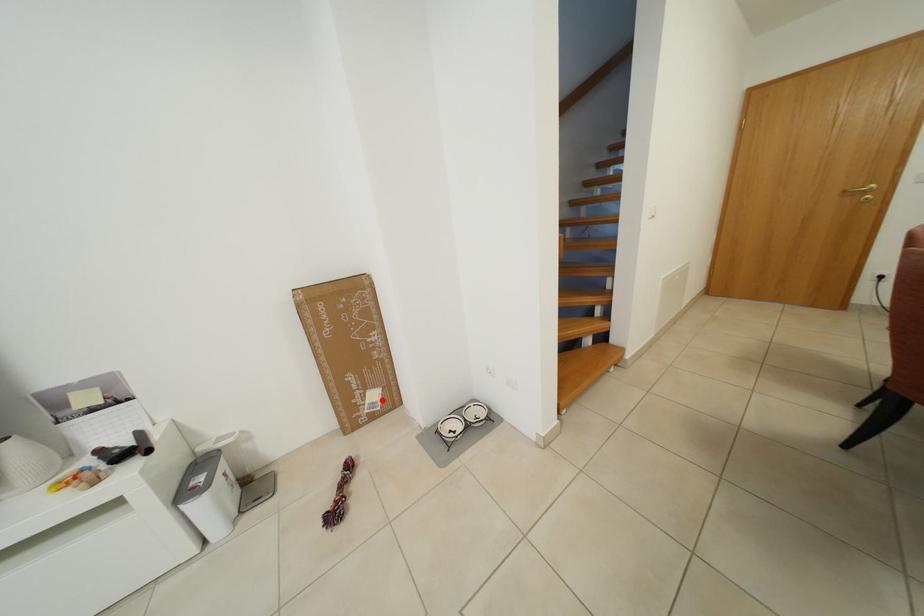
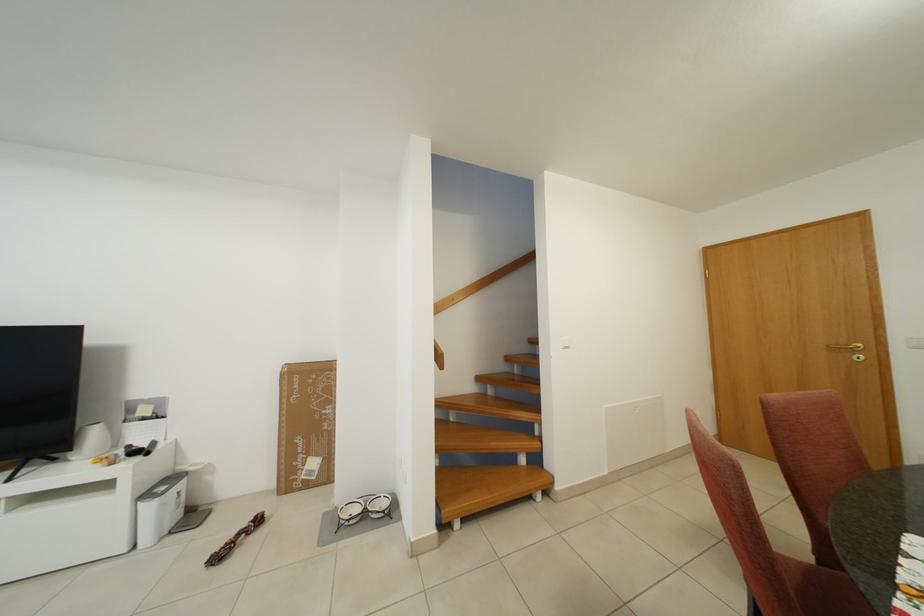
Question: I am providing you with two images of the same scene from different viewpoints. Image1 has a red point marked. In image2, the corresponding 3D location appears at what relative position? Reply with the corresponding letter.

Choices:
 (A) Closer
 (B) Farther

Answer: (B)